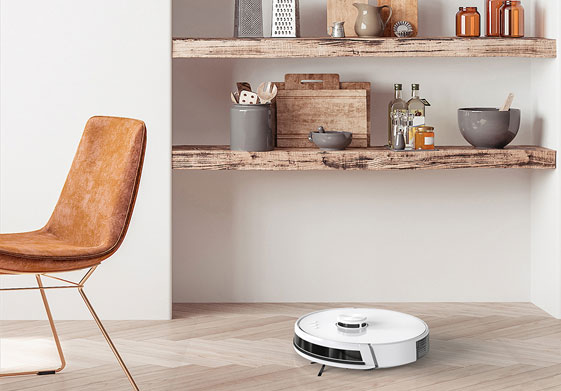
In order to click on floor in this screenshot , I will do `click(487, 361)`.